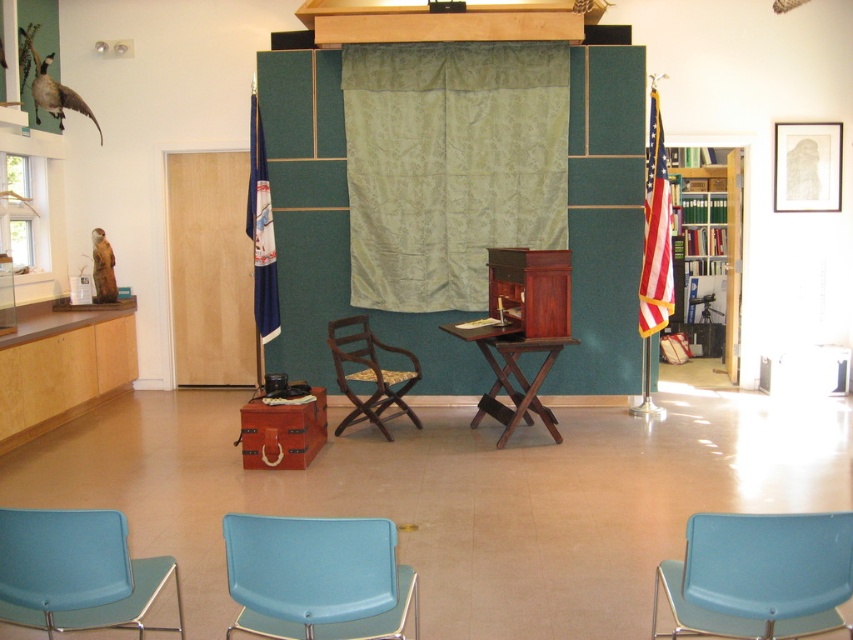
Between light blue plastic chair at lower center and wooden chair with woven seat at center, which one is positioned lower?

Positioned lower is light blue plastic chair at lower center.

Is point (248, 544) farther from viewer compared to point (347, 424)?

No.

Which is behind, point (283, 621) or point (381, 378)?

The point (381, 378) is behind.

Image resolution: width=853 pixels, height=640 pixels. I want to click on light blue plastic chair at lower center, so click(x=317, y=577).

Can you confirm if green velvet curtain at center is positioned above light blue plastic chair at lower center?

Correct, green velvet curtain at center is located above light blue plastic chair at lower center.

The width and height of the screenshot is (853, 640). Identify the location of green velvet curtain at center. click(450, 164).

Looking at this image, between matte blue chair at lower right and light blue plastic chair at lower center, which one has more height?

light blue plastic chair at lower center is taller.

Is point (833, 525) farther from camera compared to point (265, 634)?

No, (833, 525) is closer to viewer.

Identify the location of matte blue chair at lower right. Image resolution: width=853 pixels, height=640 pixels. (758, 576).